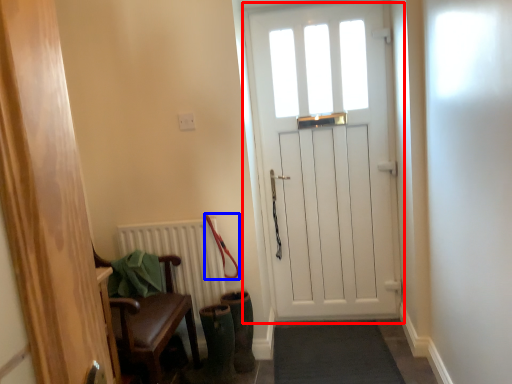
Question: Which object is closer to the camera taking this photo, screen door (highlighted by a red box) or leash (highlighted by a blue box)?

Choices:
 (A) screen door
 (B) leash

Answer: (B)